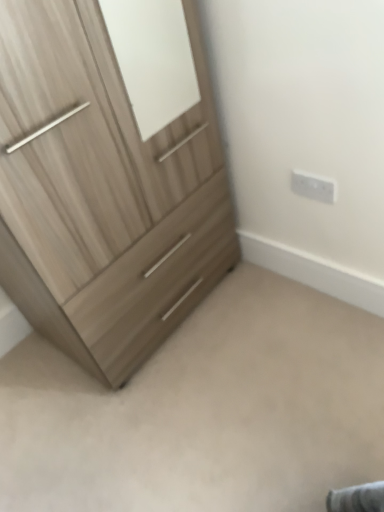
Question: Is point (372, 456) closer or farther from the camera than point (334, 186)?

Choices:
 (A) farther
 (B) closer

Answer: (B)

Question: Is light wood dresser at lower left bigger or smaller than white plastic electric outlet at upper right?

Choices:
 (A) big
 (B) small

Answer: (A)

Question: Considering the real-world distances, which object is farthest from the light wood dresser at lower left?

Choices:
 (A) light wood/texture chest of drawers at left
 (B) white plastic electric outlet at upper right

Answer: (B)

Question: Estimate the real-world distances between objects in this image. Which object is farther from the white plastic electric outlet at upper right?

Choices:
 (A) light wood/texture chest of drawers at left
 (B) light wood dresser at lower left

Answer: (B)